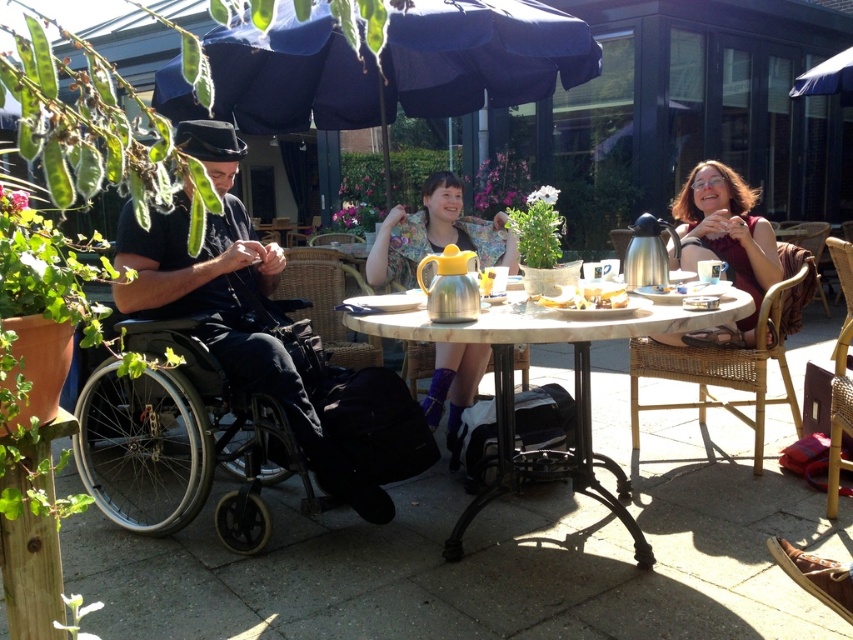
Question: Which point appears closest to the camera in this image?

Choices:
 (A) (264, 45)
 (B) (761, 236)
 (C) (622, 292)

Answer: (C)

Question: Estimate the real-world distances between objects in this image. Which object is closer to the dark blue fabric umbrella at upper center?

Choices:
 (A) matte brown sweater at upper right
 (B) black matte wheelchair at left
 (C) marble table at center
 (D) metallic silver teapot at center

Answer: (D)

Question: Can you confirm if matte brown sweater at upper right is positioned below yellow matte bread at center?

Choices:
 (A) no
 (B) yes

Answer: (A)

Question: From the image, what is the correct spatial relationship of dark blue fabric umbrella at upper center in relation to yellow matte bread at center?

Choices:
 (A) right
 (B) left

Answer: (B)

Question: Based on their relative distances, which object is nearer to the dark blue fabric umbrella at upper center?

Choices:
 (A) black matte wheelchair at left
 (B) marble table at center
 (C) metallic silver teapot at center

Answer: (C)

Question: Can you confirm if dark blue fabric umbrella at upper center is positioned to the right of matte brown sweater at upper right?

Choices:
 (A) yes
 (B) no

Answer: (B)